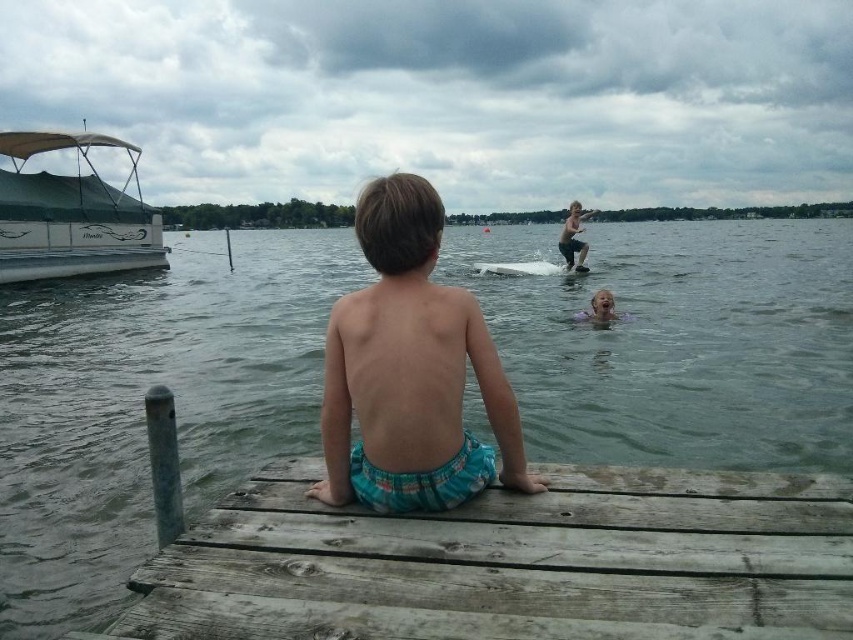
You are a photographer trying to capture the entire scene of the clear water at center and the white matte boat at upper left in one shot. Which object should you focus on first to ensure both are in frame?

The clear water at center is bigger than the white matte boat at upper left, so you should focus on the white matte boat at upper left first to ensure both fit in the frame.

You are a photographer trying to capture the scene. You want to ensure that both the clear water at center and the smooth skin person at upper center are in the frame. Based on their positions, which object should you focus on first to ensure both are visible?

The clear water at center is to the left of smooth skin person at upper center. To ensure both are visible, focus on the smooth skin person at upper center first as it is positioned to the right, allowing the clear water at center to be captured in the frame as well.